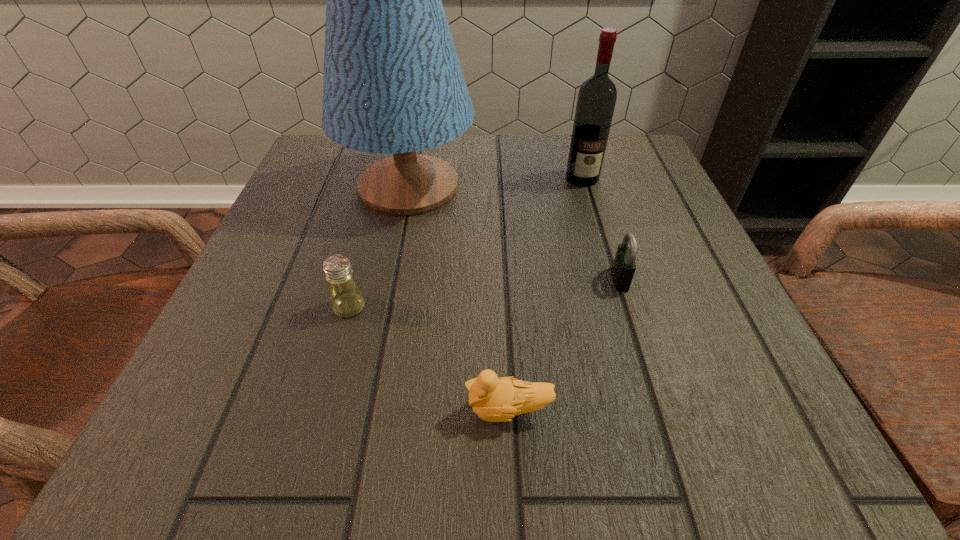
I want to click on object present at the far right corner, so click(597, 96).

Locate an element on the screen. The width and height of the screenshot is (960, 540). vacant space at the far edge of the desktop is located at coordinates (451, 158).

Identify the location of free region at the near edge. (540, 433).

At what (x,y) coordinates should I click in order to perform the action: click on vacant region at the left edge of the desktop. Please return your answer as a coordinate pair (x, y). Looking at the image, I should click on (283, 346).

I want to click on vacant space at the right edge of the desktop, so click(x=716, y=275).

Image resolution: width=960 pixels, height=540 pixels. In the image, there is a desktop. What are the coordinates of `free space at the far left corner` in the screenshot? It's located at (356, 152).

Locate an element on the screen. The width and height of the screenshot is (960, 540). vacant region at the near left corner is located at coordinates (261, 399).

In order to click on free spot at the far right corner of the desktop in this screenshot , I will do `click(620, 145)`.

Where is `vacant area at the near right corner`? The height and width of the screenshot is (540, 960). vacant area at the near right corner is located at coordinates (770, 424).

This screenshot has height=540, width=960. I want to click on free space between the second tallest object and the duckling, so click(545, 294).